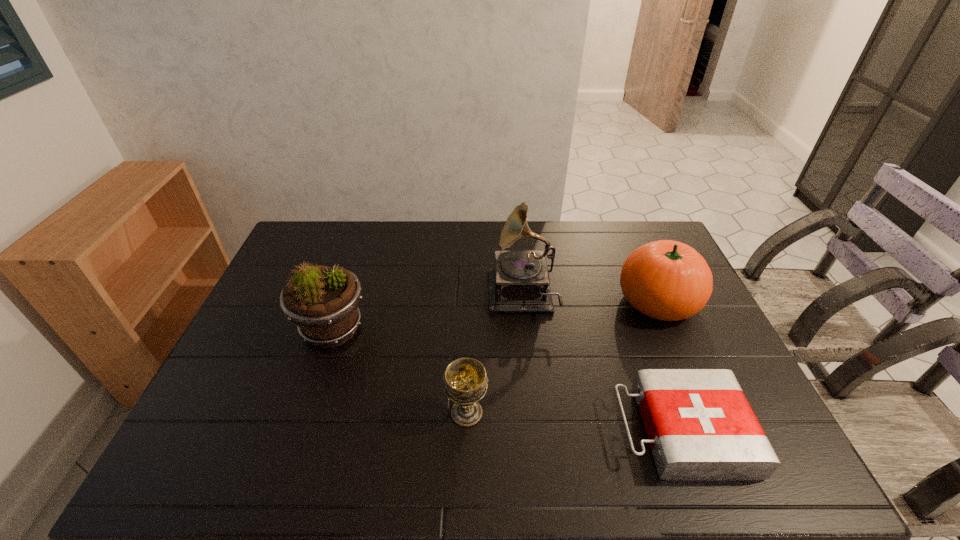
Find the location of `vacant point located between the shortest object and the flowerpot`. vacant point located between the shortest object and the flowerpot is located at coordinates (507, 380).

Locate an element on the screen. free space between the shortest object and the chalice is located at coordinates (x=574, y=422).

Identify the location of free space between the leftmost object and the first-aid kit. (507, 380).

Identify the location of free space between the first-aid kit and the third shortest object. (669, 366).

Find the location of a particular element. object that is the fourth closest to the first-aid kit is located at coordinates (322, 301).

Identify the location of object that can be found as the closest to the record player. (668, 280).

Identify the location of free point that satisfies the following two spatial constraints: 1. on the back side of the third tallest object; 2. on the left side of the leftmost object. The image size is (960, 540). (342, 301).

This screenshot has height=540, width=960. In order to click on vacant space that satisfies the following two spatial constraints: 1. on the horn of the pumpkin; 2. on the right side of the third object from right to left in this screenshot , I will do `click(522, 301)`.

The height and width of the screenshot is (540, 960). What are the coordinates of `vacant space that satisfies the following two spatial constraints: 1. on the horn of the record player; 2. on the back side of the pumpkin` in the screenshot? It's located at (522, 301).

You are a GUI agent. You are given a task and a screenshot of the screen. Output one action in this format:
    pyautogui.click(x=<x>, y=<y>)
    Task: Click on the vacant point that satisfies the following two spatial constraints: 1. on the front side of the pumpkin; 2. on the front side of the first-aid kit
    The width and height of the screenshot is (960, 540).
    Given the screenshot: What is the action you would take?
    pyautogui.click(x=714, y=431)